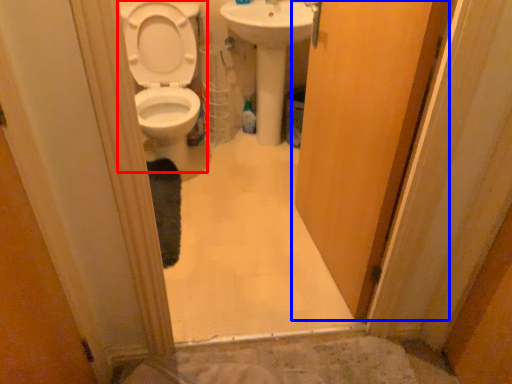
Question: Among these objects, which one is farthest to the camera, toilet (highlighted by a red box) or door (highlighted by a blue box)?

Choices:
 (A) toilet
 (B) door

Answer: (A)